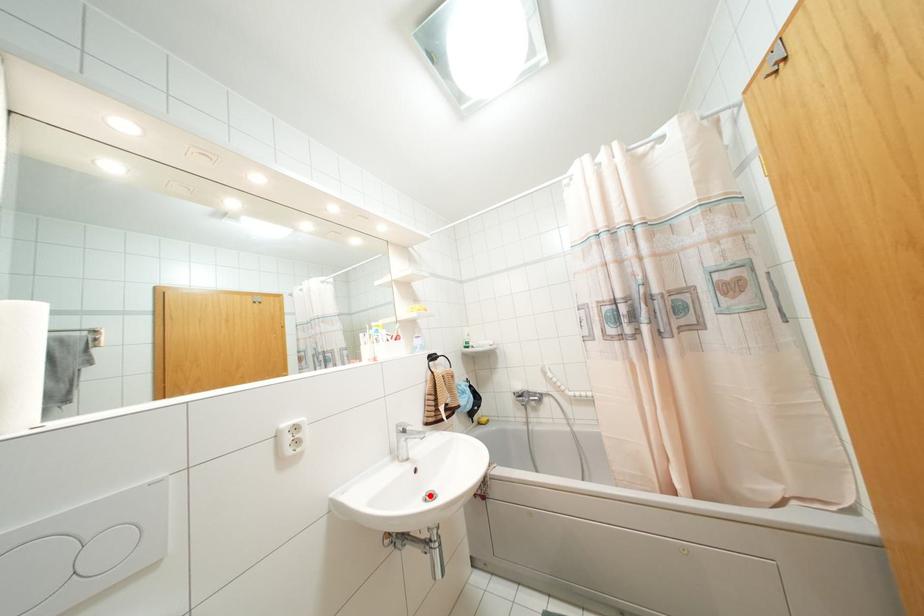
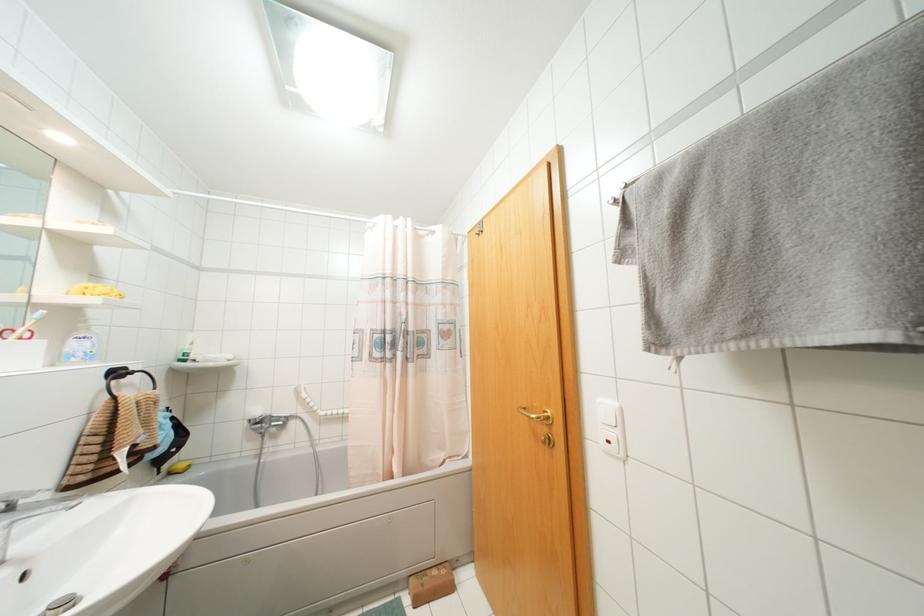
Question: I am providing you with two images of the same scene from different viewpoints. Image1 has a red point marked. In image2, the corresponding 3D location appears at what relative position? Reply with the corresponding letter.

Choices:
 (A) Closer
 (B) Farther

Answer: (A)